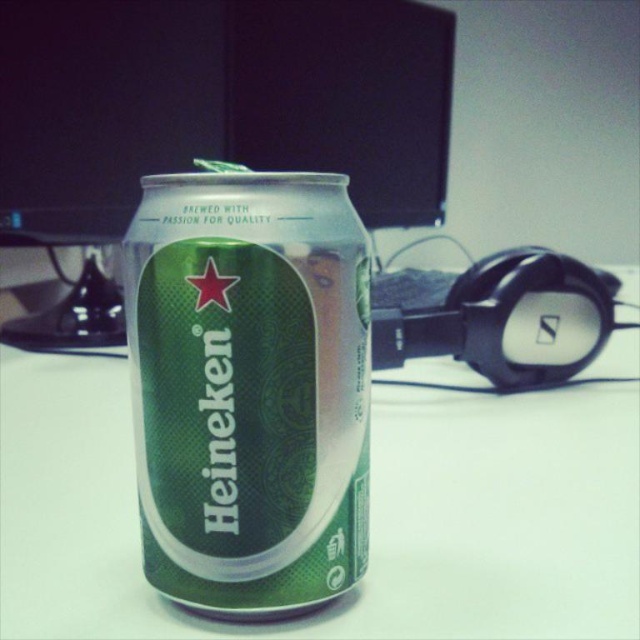
Question: Considering the relative positions of green metallic can at center and green textured can at center in the image provided, where is green metallic can at center located with respect to green textured can at center?

Choices:
 (A) right
 (B) left

Answer: (A)

Question: Which point is farther to the camera?

Choices:
 (A) (476, 618)
 (B) (200, 228)

Answer: (A)

Question: Can you confirm if green metallic can at center is thinner than green textured can at center?

Choices:
 (A) no
 (B) yes

Answer: (A)

Question: Can you confirm if green metallic can at center is thinner than green textured can at center?

Choices:
 (A) no
 (B) yes

Answer: (A)

Question: Which point is farther to the camera?

Choices:
 (A) green metallic can at center
 (B) green textured can at center

Answer: (A)